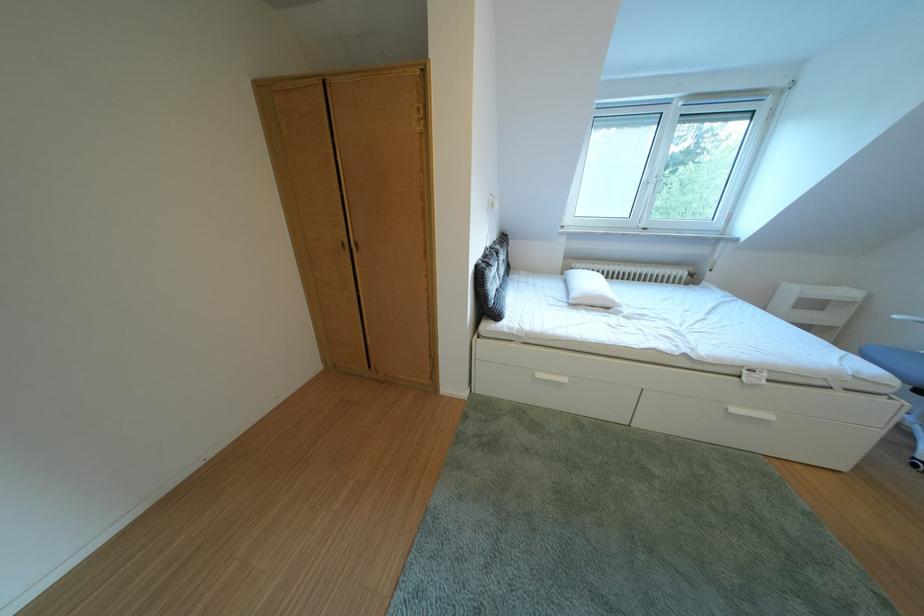
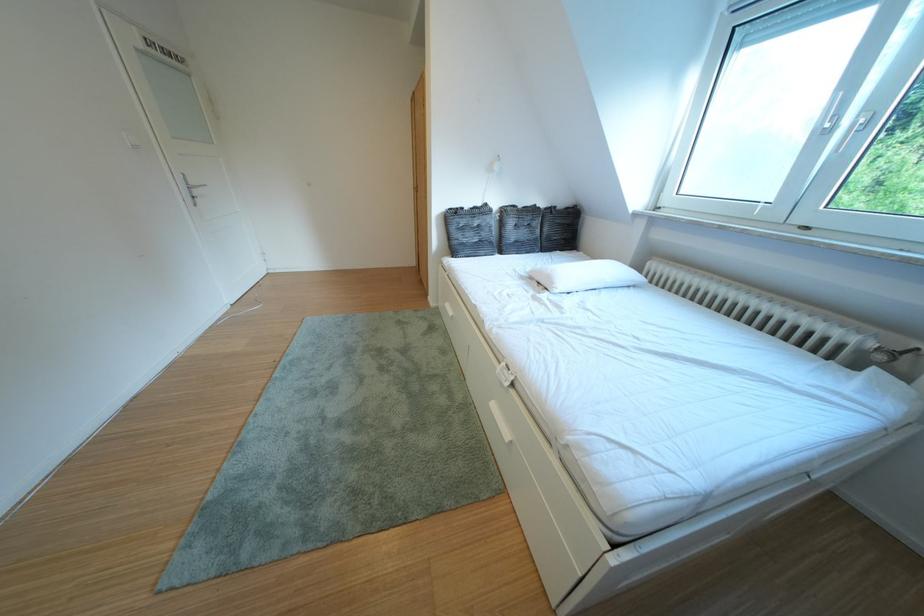
Where in the second image is the point corresponding to (626,306) from the first image?

(565, 288)